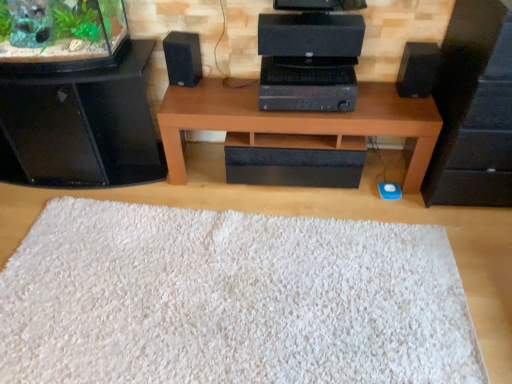
At what (x,y) coordinates should I click in order to perform the action: click on spots to the right of black matte speaker at left, the second speaker when ordered from right to left. Please return your answer as a coordinate pair (x, y). Looking at the image, I should click on (220, 87).